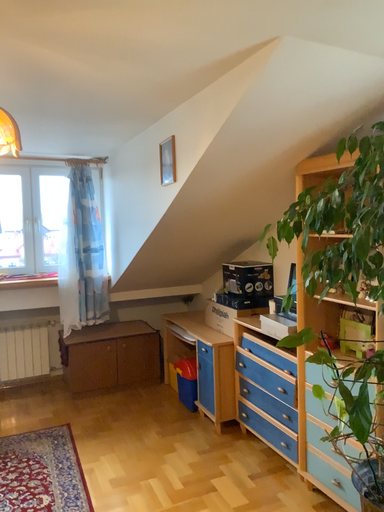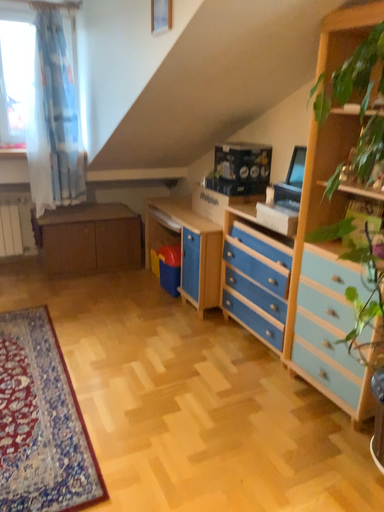
Question: How did the camera likely rotate when shooting the video?

Choices:
 (A) rotated downward
 (B) rotated upward

Answer: (A)